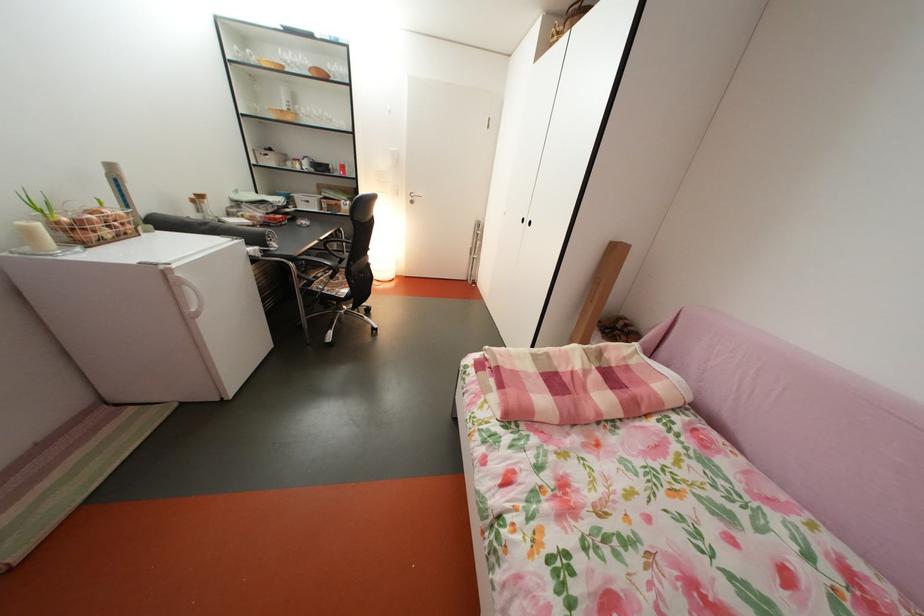
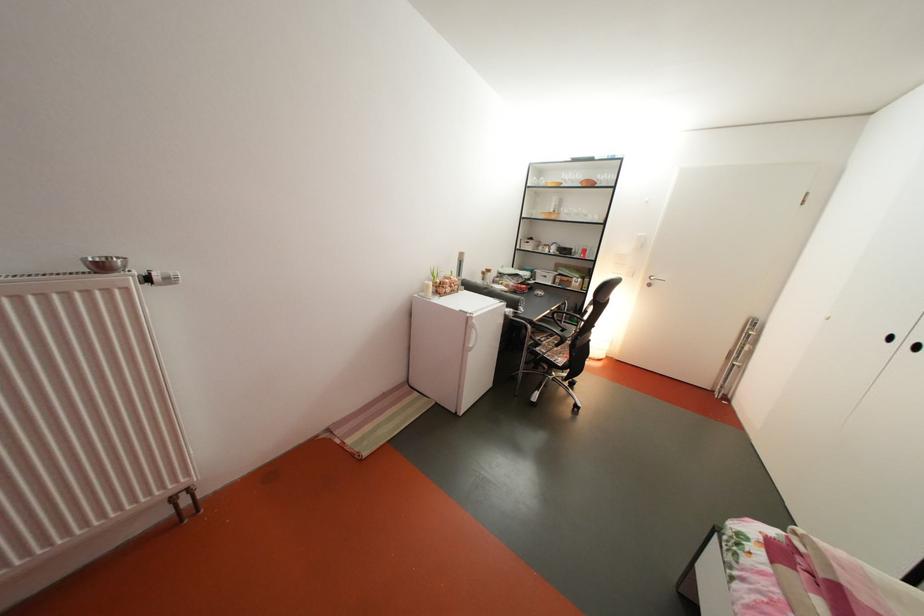
Locate, in the second image, the point that corresponds to pixel 343 127 in the first image.

(598, 222)